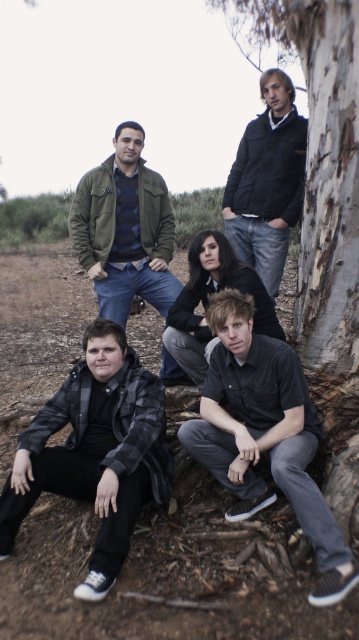
Question: Estimate the real-world distances between objects in this image. Which object is closer to the leather jacket at lower left?

Choices:
 (A) matte green jacket at upper left
 (B) black cotton shirt at lower right

Answer: (B)

Question: Estimate the real-world distances between objects in this image. Which object is farther from the dirt ground at center?

Choices:
 (A) black cotton shirt at lower right
 (B) smooth bark tree at right

Answer: (B)

Question: Can you confirm if matte green jacket at upper left is positioned below black leather jacket at center?

Choices:
 (A) yes
 (B) no

Answer: (B)

Question: Which object is the closest to the matte green jacket at upper left?

Choices:
 (A) black cotton shirt at lower right
 (B) leather jacket at lower left

Answer: (B)

Question: Is smooth bark tree at right above dark blue jacket at center?

Choices:
 (A) yes
 (B) no

Answer: (A)

Question: Considering the relative positions of dirt ground at center and leather jacket at lower left in the image provided, where is dirt ground at center located with respect to leather jacket at lower left?

Choices:
 (A) right
 (B) left

Answer: (A)